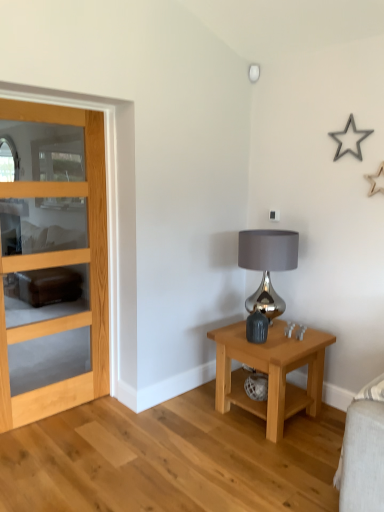
You are a GUI agent. You are given a task and a screenshot of the screen. Output one action in this format:
    pyautogui.click(x=<x>, y=<y>)
    Task: Click on the free point above light wood/glass door at left (from a real-world perspective)
    Image resolution: width=384 pixels, height=512 pixels.
    Given the screenshot: What is the action you would take?
    pyautogui.click(x=52, y=105)